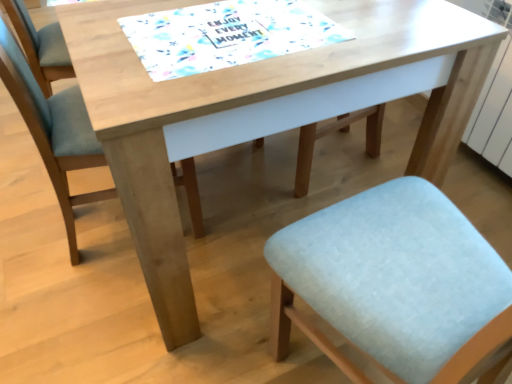
The width and height of the screenshot is (512, 384). I want to click on unoccupied region to the right of white paper placemat at center, so click(x=387, y=28).